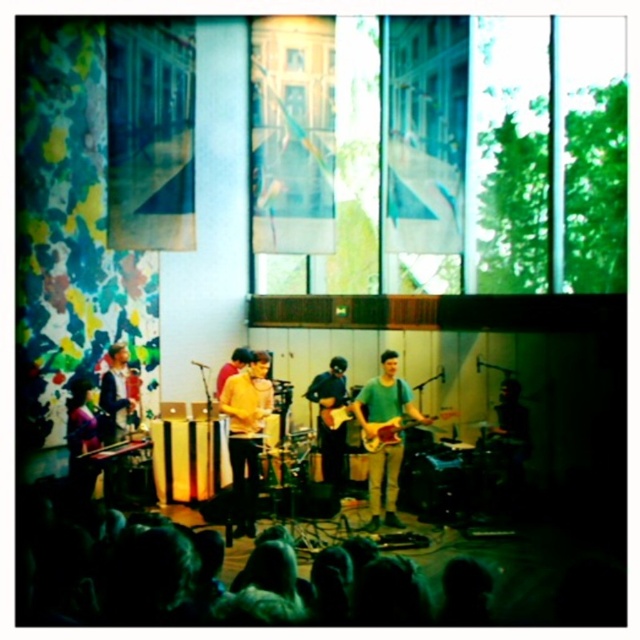
From the picture: You are a stagehand setting up microphones for the two guitars. The green matte guitar at center and the wooden electric guitar at center are both on stage. Which guitar requires a wider microphone stand base to prevent tipping over, considering their widths?

The green matte guitar at center requires a wider microphone stand base because its width surpasses that of the wooden electric guitar at center.

What are the coordinates of the green matte guitar at center?

The green matte guitar at center is located at coordinates point (x=385, y=397).

You are a photographer positioned at point (385, 397) in the image. You want to capture a closeup of the green matte guitar at center. Is the guitar within your current field of view?

The green matte guitar at center is located exactly at your current position at point (385, 397), so it should be directly in your field of view.